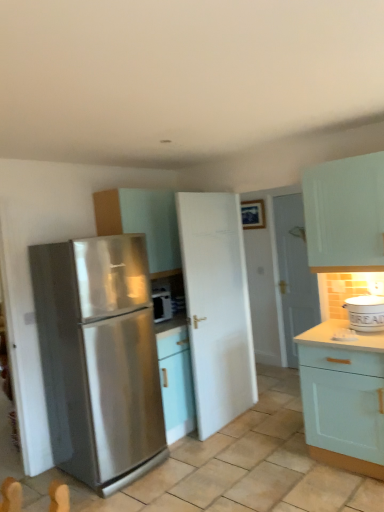
Identify the location of free spot below white matte door at center, which ranks as the first door in front-to-back order (from a real-world perspective). Image resolution: width=384 pixels, height=512 pixels. (229, 423).